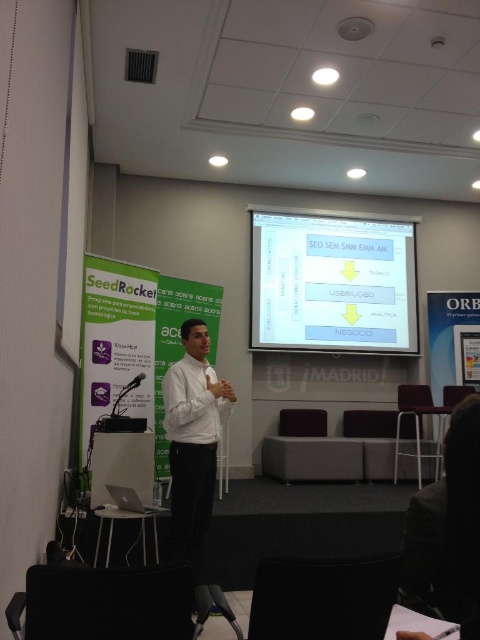
Question: Can you confirm if dark brown hair at lower right is positioned below white shirt at center?

Choices:
 (A) no
 (B) yes

Answer: (A)

Question: Which object is the farthest from the white glossy projector screen at upper center?

Choices:
 (A) dark brown hair at lower right
 (B) white shirt at center

Answer: (A)

Question: Among these objects, which one is farthest from the camera?

Choices:
 (A) dark brown hair at lower right
 (B) white glossy projector screen at upper center
 (C) white shirt at center

Answer: (B)

Question: From the image, what is the correct spatial relationship of white glossy projector screen at upper center in relation to dark brown hair at lower right?

Choices:
 (A) above
 (B) below

Answer: (A)

Question: Is dark brown hair at lower right wider than white shirt at center?

Choices:
 (A) yes
 (B) no

Answer: (B)

Question: Which object is positioned farthest from the white glossy projector screen at upper center?

Choices:
 (A) white shirt at center
 (B) dark brown hair at lower right

Answer: (B)